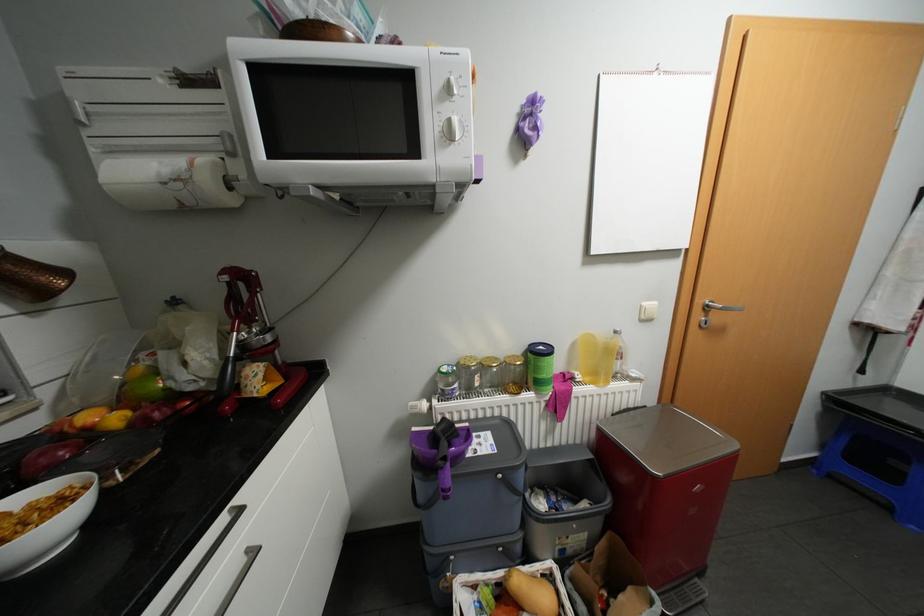
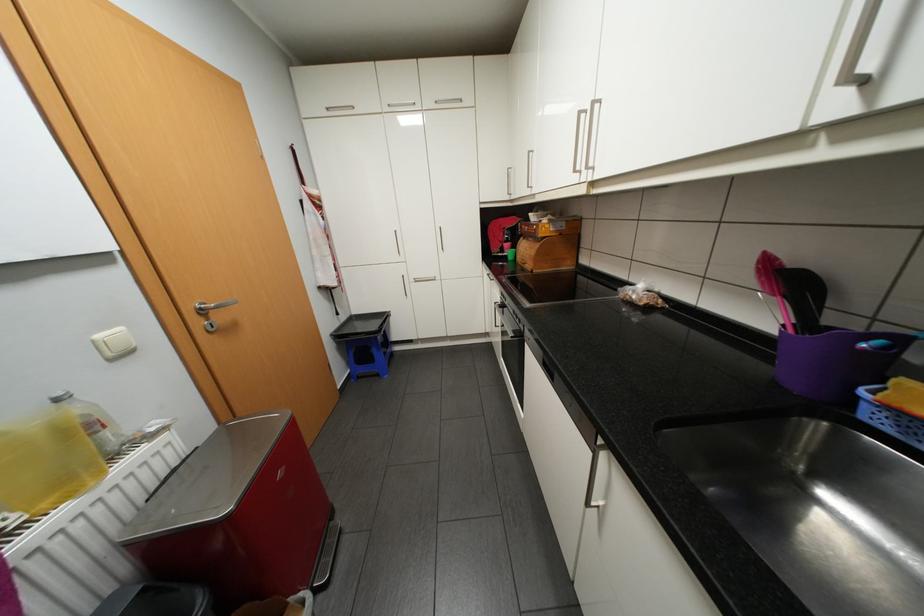
The point at (715, 305) is marked in the first image. Where is the corresponding point in the second image?

(209, 308)